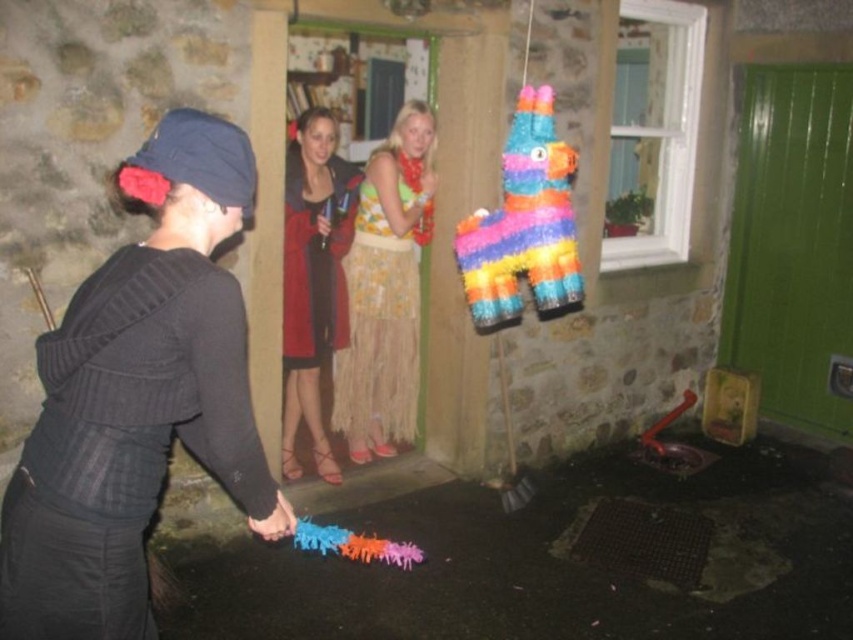
Question: Which is farther from the black knitted sweater at center?

Choices:
 (A) floral skirt at center
 (B) rainbow paper piñata at center
 (C) red leather jacket at center

Answer: (A)

Question: Which of these objects is positioned closest to the rubber toy ants at lower center?

Choices:
 (A) rainbow paper piñata at center
 (B) red leather jacket at center
 (C) floral skirt at center
 (D) rubberized plastic toy at center

Answer: (C)

Question: Is the position of rubber toy ants at lower center more distant than that of black knitted sweater at center?

Choices:
 (A) yes
 (B) no

Answer: (A)

Question: Does rubber toy ants at lower center appear over floral skirt at center?

Choices:
 (A) yes
 (B) no

Answer: (B)

Question: Which of the following is the closest to the observer?

Choices:
 (A) (317, 435)
 (B) (567, 173)
 (C) (271, 534)
 (D) (398, 561)

Answer: (C)

Question: Is rubber toy ants at lower center wider than floral skirt at center?

Choices:
 (A) no
 (B) yes

Answer: (B)